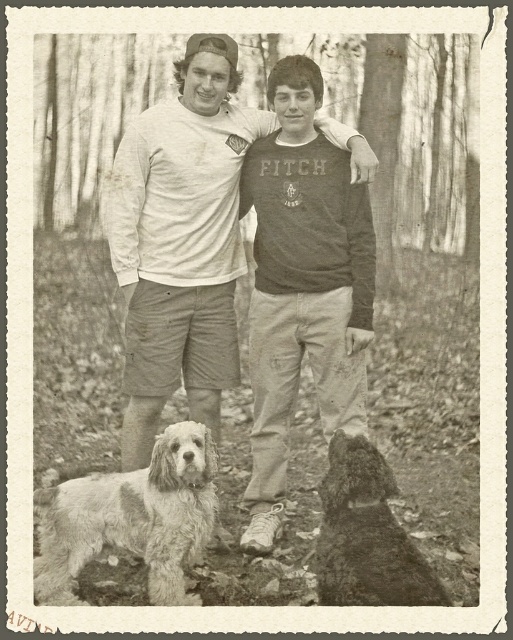
Image resolution: width=513 pixels, height=640 pixels. What do you see at coordinates (181, 241) in the screenshot?
I see `white cotton shirt at center` at bounding box center [181, 241].

Is white cotton shirt at center shorter than dark gray cotton shirt at center?

Yes, white cotton shirt at center is shorter than dark gray cotton shirt at center.

Identify the location of white cotton shirt at center. The image size is (513, 640). (181, 241).

Is white cotton shirt at center shorter than fuzzy fur dog at lower left?

Incorrect, white cotton shirt at center's height does not fall short of fuzzy fur dog at lower left's.

Can you confirm if white cotton shirt at center is wider than fuzzy fur dog at lower left?

In fact, white cotton shirt at center might be narrower than fuzzy fur dog at lower left.

The width and height of the screenshot is (513, 640). Find the location of `white cotton shirt at center`. white cotton shirt at center is located at coordinates (181, 241).

Who is positioned more to the left, dark gray cotton shirt at center or fuzzy fur dog at lower left?

From the viewer's perspective, fuzzy fur dog at lower left appears more on the left side.

From the picture: Can you confirm if dark gray cotton shirt at center is wider than fuzzy fur dog at lower left?

Incorrect, dark gray cotton shirt at center's width does not surpass fuzzy fur dog at lower left's.

Who is more forward, (x=274, y=182) or (x=73, y=497)?

Positioned in front is point (x=73, y=497).

This screenshot has width=513, height=640. In order to click on dark gray cotton shirt at center in this screenshot , I will do `click(303, 285)`.